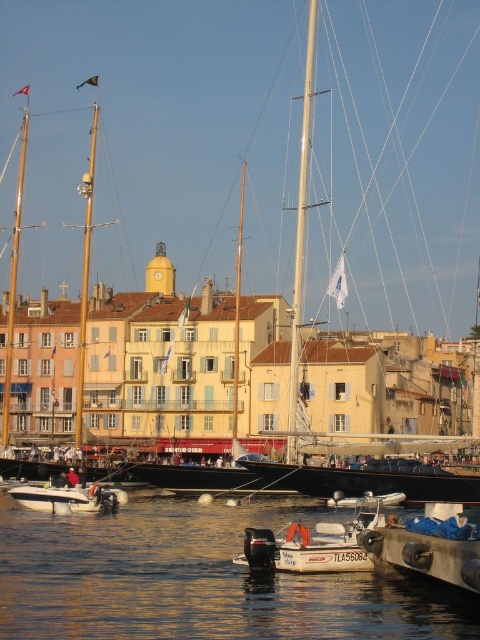
You are a photographer planning to capture a sunset shot of the harbor. You have a camera with a 50mm lens that can focus on objects up to 10 meters away. You are currently positioned at the waterfront near the wooden mast sailboat at left. Can you clearly capture the white matte sailboat at upper center with this lens?

The white matte sailboat at upper center is larger in size compared to the wooden mast sailboat at left. Since the white matte sailboat at upper center is bigger, it might be closer to you, so the 50mm lens should be able to capture it clearly within the 10 meters range.

You are a sailor trying to navigate a small boat through the harbor. You need to position your boat so that it aligns with the direction of the polished wood mast at center. Based on its coordinates, what is the best heading to set your compass?

The polished wood mast at center is located at coordinates point (84, 276), so the best heading to align with it would be approximately 0.433 in the x and 0.177 in the y direction.

You are standing on the dock and want to take a photo of the white matte sailboat at upper center. If your camera has a maximum zoom range of 50 meters, will you be able to capture the boat clearly without moving closer?

The white matte sailboat at upper center is 83.14 meters away from the viewer, which exceeds the camera maximum zoom range of 50 meters. Therefore, you will not be able to capture the boat clearly without moving closer.